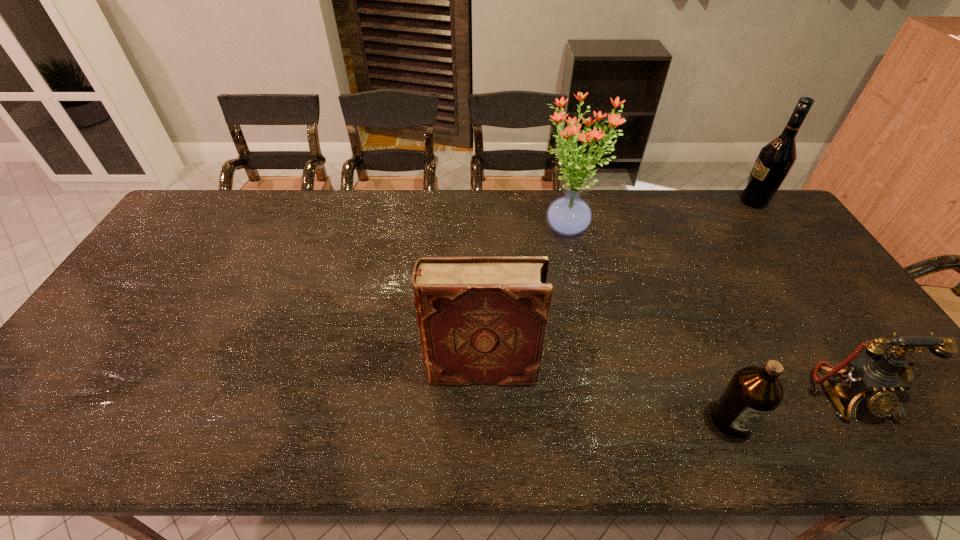
This screenshot has width=960, height=540. Find the location of `vacant area that satisfies the following two spatial constraints: 1. on the front side of the flower arrangement; 2. on the spine side of the leftmost object`. vacant area that satisfies the following two spatial constraints: 1. on the front side of the flower arrangement; 2. on the spine side of the leftmost object is located at coordinates (599, 369).

Image resolution: width=960 pixels, height=540 pixels. Find the location of `vacant space that satisfies the following two spatial constraints: 1. on the label of the wine bottle; 2. on the front side of the flower arrangement`. vacant space that satisfies the following two spatial constraints: 1. on the label of the wine bottle; 2. on the front side of the flower arrangement is located at coordinates (772, 227).